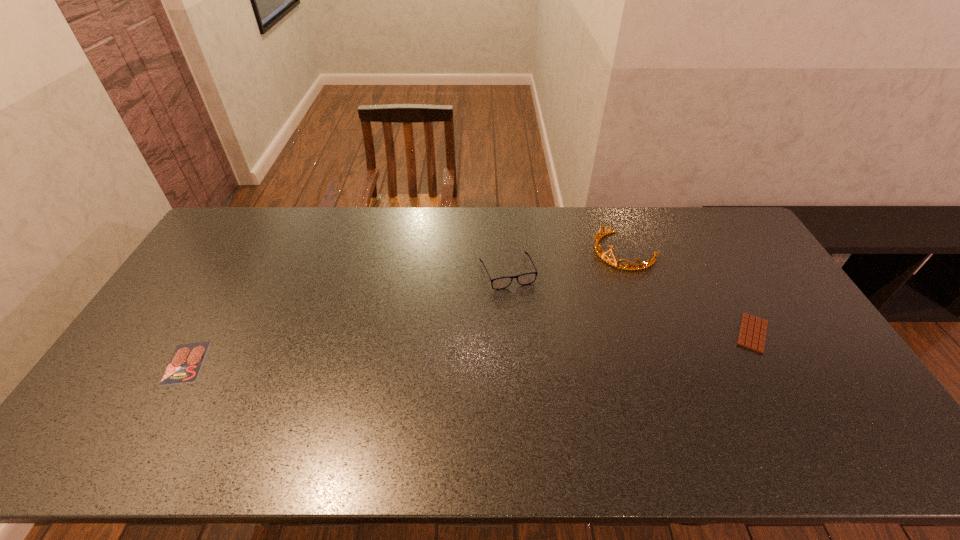
You are a GUI agent. You are given a task and a screenshot of the screen. Output one action in this format:
    pyautogui.click(x=<x>, y=<y>)
    Task: Click on the free space between the second object from left to right and the tallest object
    
    Given the screenshot: What is the action you would take?
    pyautogui.click(x=565, y=261)

The image size is (960, 540). I want to click on vacant area that lies between the third object from right to left and the shortest object, so click(347, 317).

Where is `unoccupied position between the third shortest object and the second shortest object`? This screenshot has width=960, height=540. unoccupied position between the third shortest object and the second shortest object is located at coordinates (630, 302).

Point out which object is positioned as the third nearest to the salami. Please provide its 2D coordinates. Your answer should be formatted as a tuple, i.e. [(x, y)], where the tuple contains the x and y coordinates of a point satisfying the conditions above.

[(752, 335)]

Point out which object is positioned as the nearest to the third shortest object. Please provide its 2D coordinates. Your answer should be formatted as a tuple, i.e. [(x, y)], where the tuple contains the x and y coordinates of a point satisfying the conditions above.

[(601, 255)]

This screenshot has height=540, width=960. Identify the location of free spot that satisfies the following two spatial constraints: 1. on the back side of the third object from right to left; 2. on the left side of the second object from right to left. (x=506, y=251).